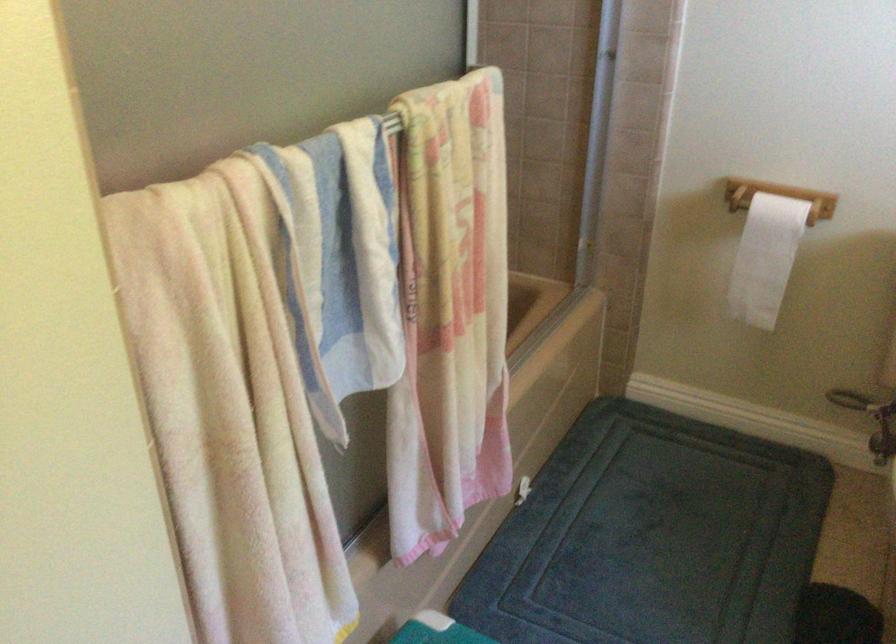
The images are taken continuously from a first-person perspective. In which direction is your viewpoint rotating?

The rotation direction of the camera is left-down.